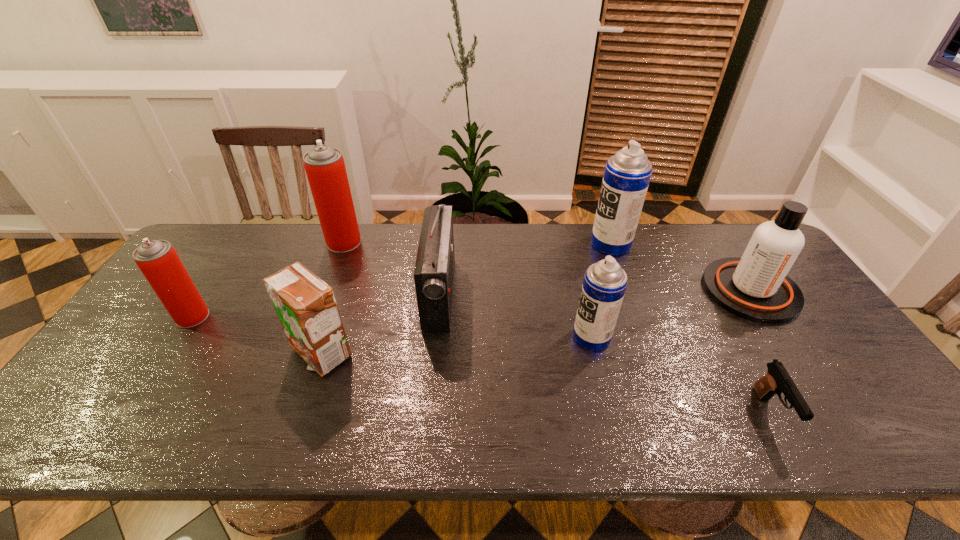
The image size is (960, 540). What are the coordinates of `the right red aerosol can` in the screenshot? It's located at (324, 165).

Locate an element on the screen. This screenshot has height=540, width=960. the third aerosol can from right to left is located at coordinates click(324, 165).

Where is `the right blue aerosol can`? The height and width of the screenshot is (540, 960). the right blue aerosol can is located at coordinates (627, 174).

This screenshot has width=960, height=540. I want to click on the bigger blue aerosol can, so click(x=627, y=174).

The image size is (960, 540). Identify the location of the fifth object from right to left. point(434,270).

The height and width of the screenshot is (540, 960). I want to click on white cleansing agent, so click(755, 287).

The height and width of the screenshot is (540, 960). Find the location of `the left blue aerosol can`. the left blue aerosol can is located at coordinates (605, 282).

The width and height of the screenshot is (960, 540). Find the location of `the second aerosol can from right to left`. the second aerosol can from right to left is located at coordinates tap(605, 282).

In order to click on the leftmost object in this screenshot , I will do coord(157,259).

Identify the location of the leftmost aerosol can. This screenshot has height=540, width=960. (157, 259).